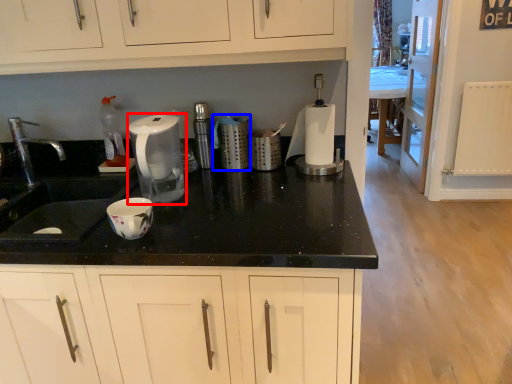
Question: Which object appears closest to the camera in this image, home appliance (highlighted by a red box) or kitchen appliance (highlighted by a blue box)?

Choices:
 (A) home appliance
 (B) kitchen appliance

Answer: (A)